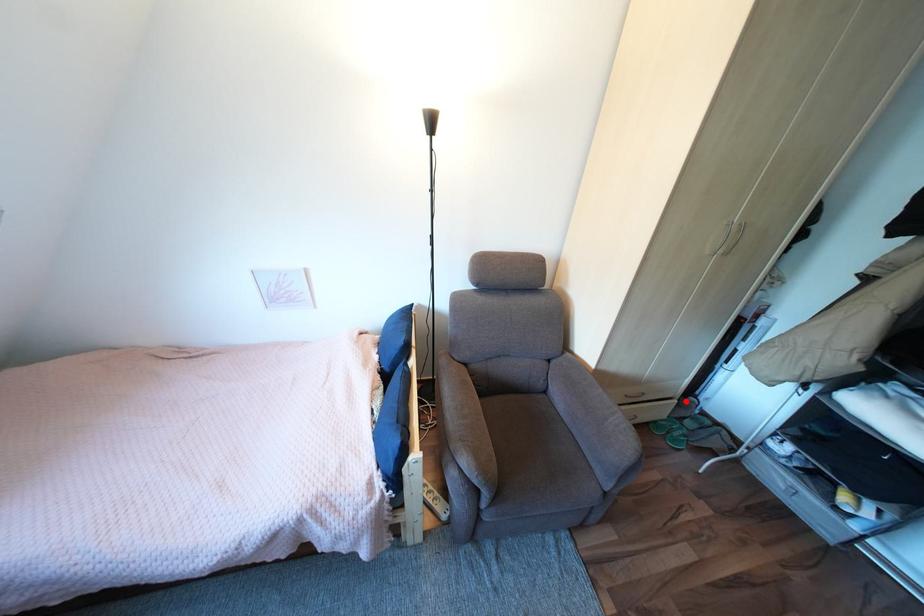
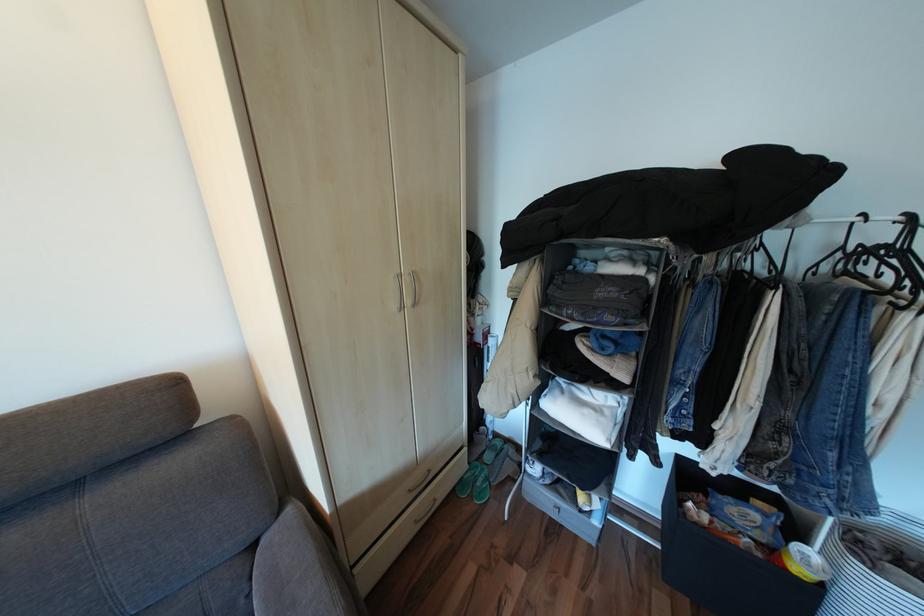
Question: I am providing you with two images of the same scene from different viewpoints. In image1, a red point is highlighted. Considering the same 3D point in image2, which of the following is correct?

Choices:
 (A) It is closer
 (B) It is farther

Answer: (B)